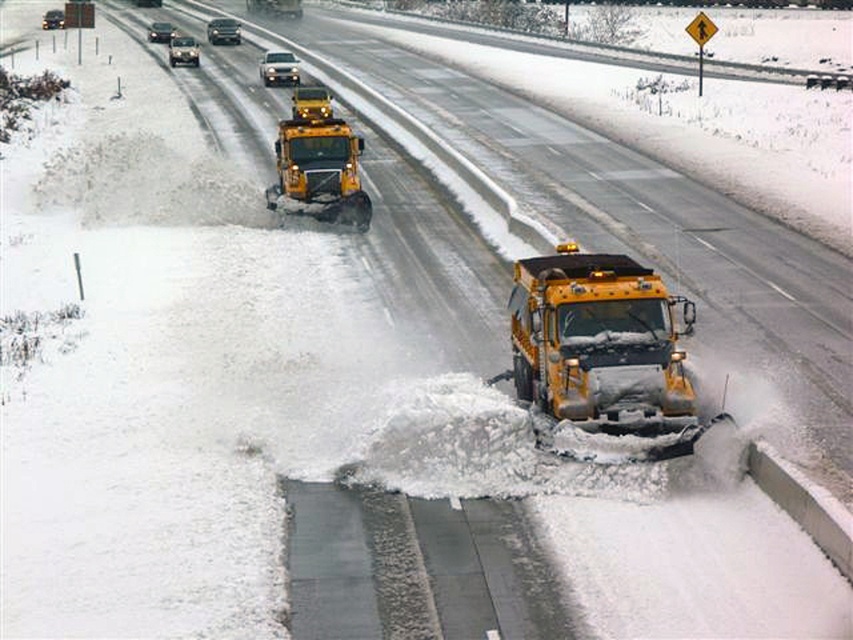
Question: Which object is positioned farthest from the shiny silver sedan at upper center?

Choices:
 (A) yellow matte/snowplow at center
 (B) shiny silver sedan at upper left
 (C) metallic silver sedan at upper center

Answer: (A)

Question: Is yellow matte/snowplow at center further to camera compared to metallic silver sedan at upper left?

Choices:
 (A) yes
 (B) no

Answer: (B)

Question: Which object is the closest to the metallic silver sedan at upper center?

Choices:
 (A) yellow matte snowplow at center
 (B) shiny black sedan at upper left

Answer: (B)

Question: Is shiny silver sedan at upper center closer to camera compared to shiny silver sedan at upper left?

Choices:
 (A) yes
 (B) no

Answer: (B)

Question: Estimate the real-world distances between objects in this image. Which object is closer to the shiny silver sedan at upper left?

Choices:
 (A) shiny silver sedan at upper center
 (B) yellow matte snowplow at center
 (C) metallic silver sedan at upper left
 (D) yellow matte/snowplow at center

Answer: (A)

Question: Can you confirm if metallic silver sedan at upper center is thinner than shiny silver sedan at upper left?

Choices:
 (A) yes
 (B) no

Answer: (B)